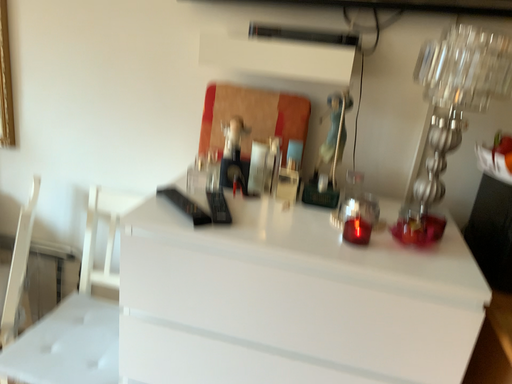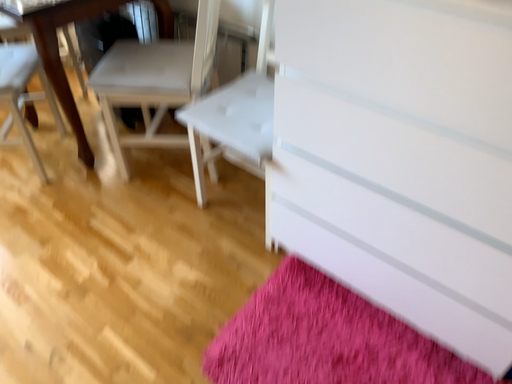
Question: How did the camera likely rotate when shooting the video?

Choices:
 (A) rotated upward
 (B) rotated downward

Answer: (B)